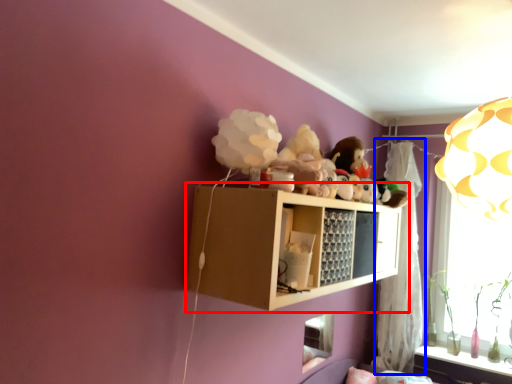
Question: Among these objects, which one is farthest to the camera, shelf (highlighted by a red box) or curtain (highlighted by a blue box)?

Choices:
 (A) shelf
 (B) curtain

Answer: (B)